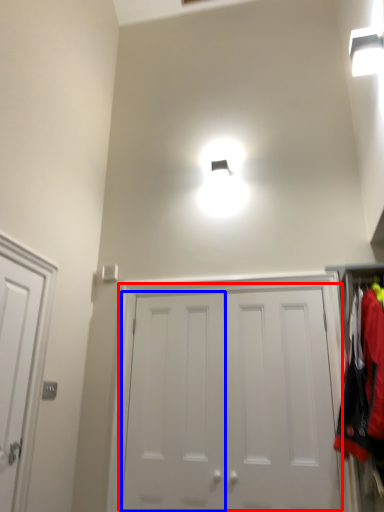
Question: Which of the following is the farthest to the observer, door (highlighted by a red box) or door (highlighted by a blue box)?

Choices:
 (A) door
 (B) door

Answer: (B)